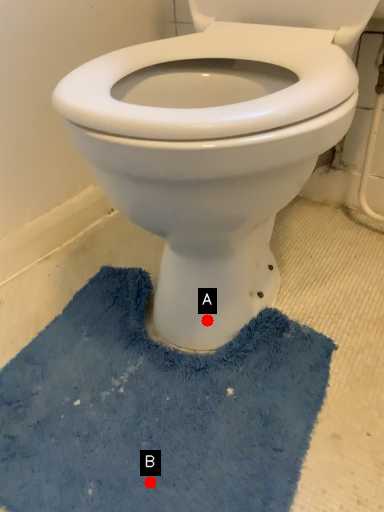
Question: Two points are circled on the image, labeled by A and B beside each circle. Which point is farther from the camera taking this photo?

Choices:
 (A) A is further
 (B) B is further

Answer: (A)